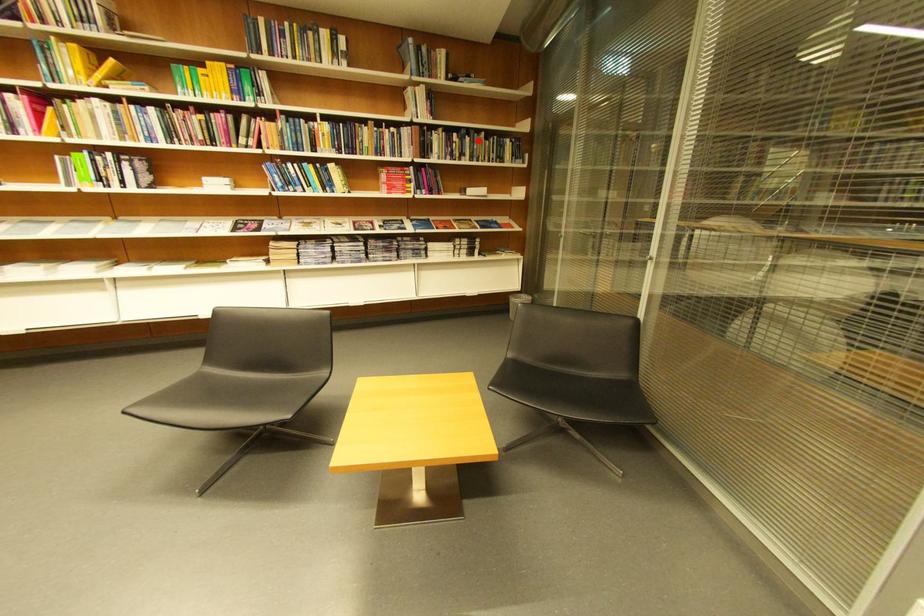
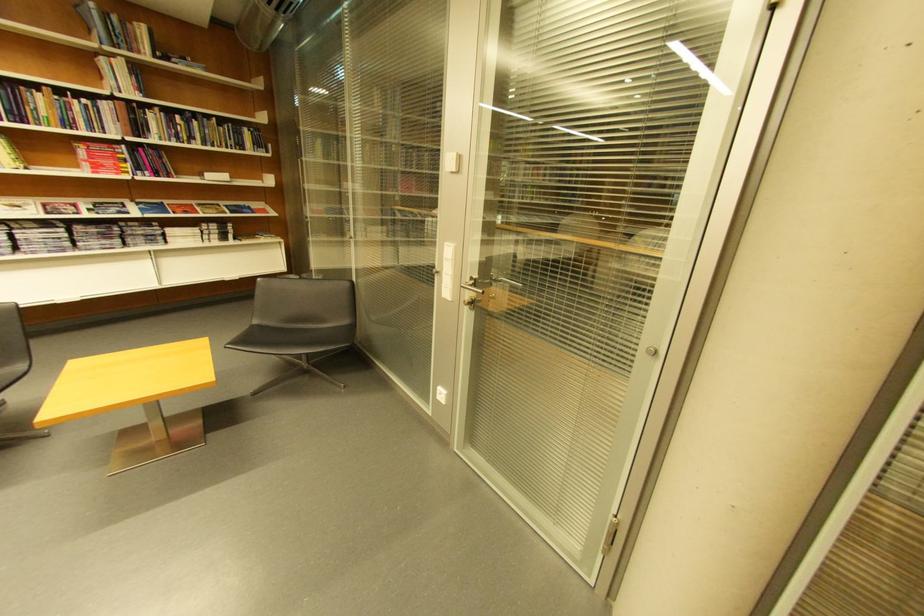
Question: I am providing you with two images of the same scene from different viewpoints. Image1 has a red point marked. In image2, the corresponding 3D location appears at what relative position? Reply with the corresponding letter.

Choices:
 (A) Closer
 (B) Farther

Answer: (B)